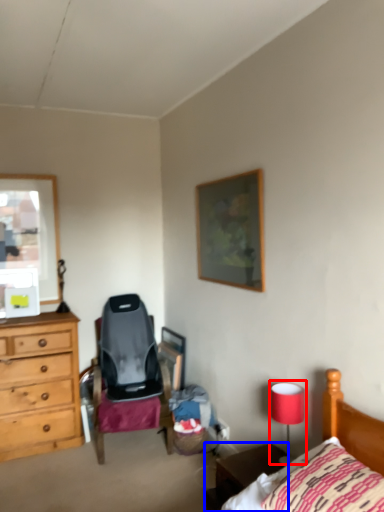
Question: Among these objects, which one is nearest to the camera, table lamp (highlighted by a red box) or nightstand (highlighted by a blue box)?

Choices:
 (A) table lamp
 (B) nightstand

Answer: (B)